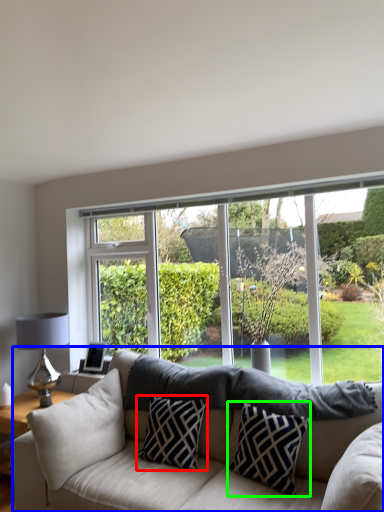
Question: Which object is the closest to the pillow (highlighted by a red box)? Choose among these: studio couch (highlighted by a blue box) or pillow (highlighted by a green box).

Choices:
 (A) studio couch
 (B) pillow

Answer: (A)